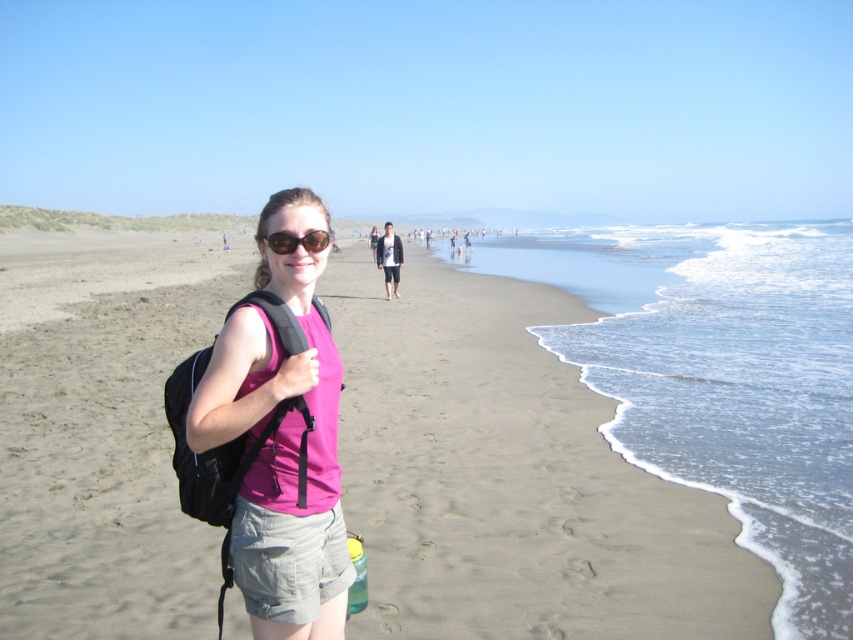
You are a photographer trying to capture the person wearing the pink sleeveless top at center. Your camera has a zoom lens that can focus on specific coordinates. The coordinates point at (x=281, y=440) are marked. Where exactly on the person should you aim the camera to ensure the pink sleeveless top at center is in focus?

The point at (x=281, y=440) is on the pink fabric shirt at center, so aiming the camera at that coordinate will ensure the pink sleeveless top at center is in focus.